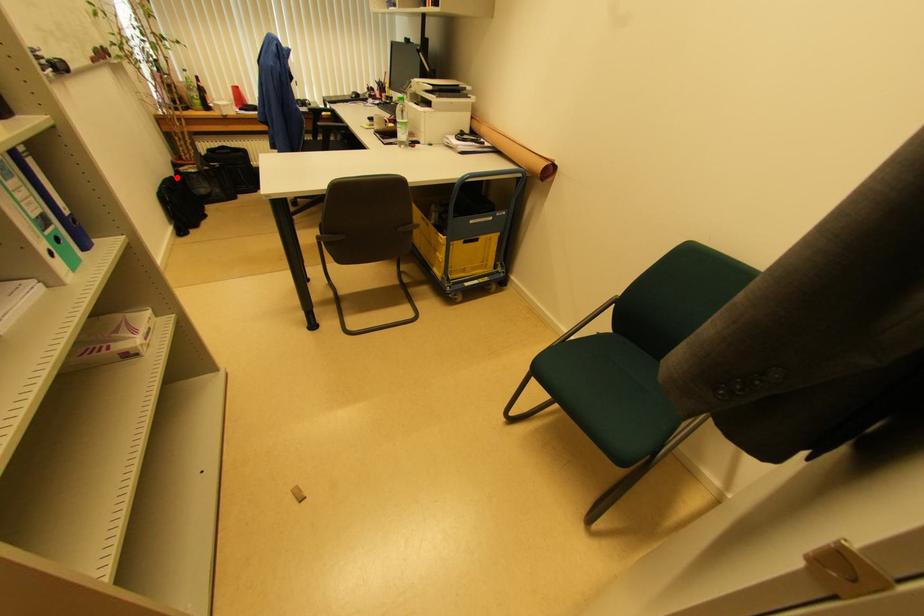
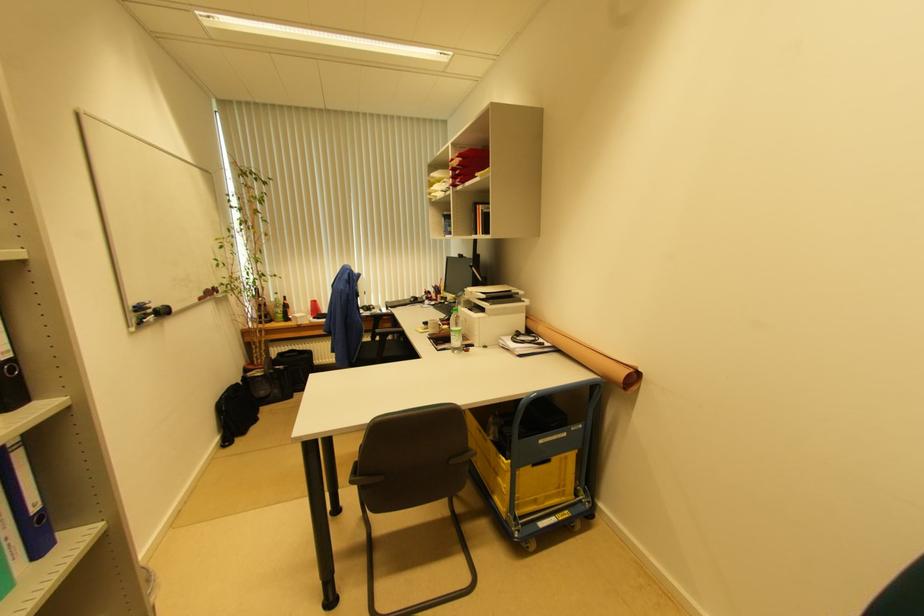
The point at the highlighted location is marked in the first image. Where is the corresponding point in the second image?

(242, 383)